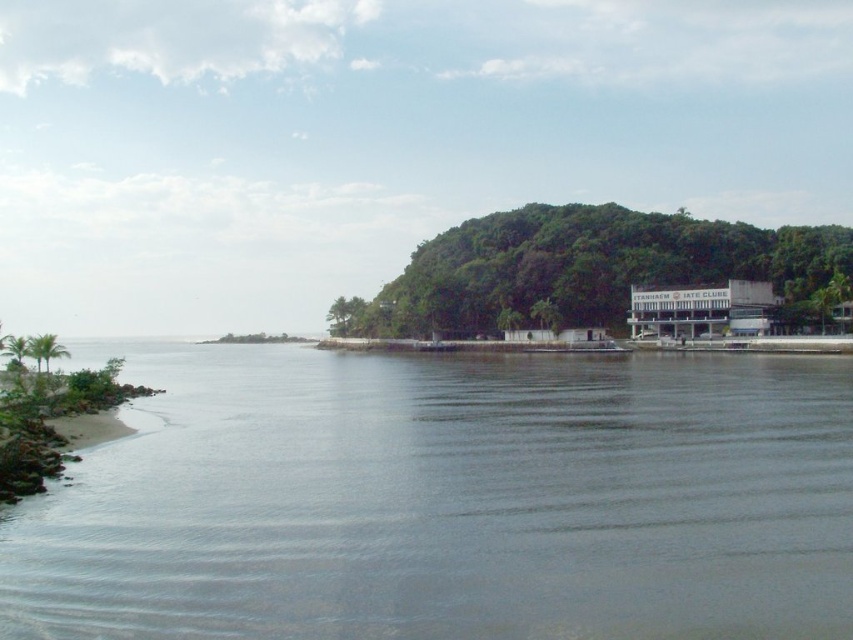
Question: Where is green leafy trees at center located in relation to green leafy tree at center in the image?

Choices:
 (A) left
 (B) right

Answer: (B)

Question: Which object is farther from the camera taking this photo?

Choices:
 (A) green leafy tree at center
 (B) green leafy palm tree at lower left
 (C) gray smooth water at center

Answer: (A)

Question: Which of the following is the closest to the observer?

Choices:
 (A) green leafy trees at center
 (B) green leafy tree at center
 (C) green leafy palm tree at lower left

Answer: (C)

Question: Does green leafy trees at center have a larger size compared to green leafy tree at center?

Choices:
 (A) no
 (B) yes

Answer: (B)

Question: Estimate the real-world distances between objects in this image. Which object is closer to the green leafy palm tree at lower left?

Choices:
 (A) green leafy trees at center
 (B) gray smooth water at center
 (C) green leafy tree at center

Answer: (B)

Question: Observing the image, what is the correct spatial positioning of green leafy trees at center in reference to green leafy palm tree at lower left?

Choices:
 (A) below
 (B) above

Answer: (B)